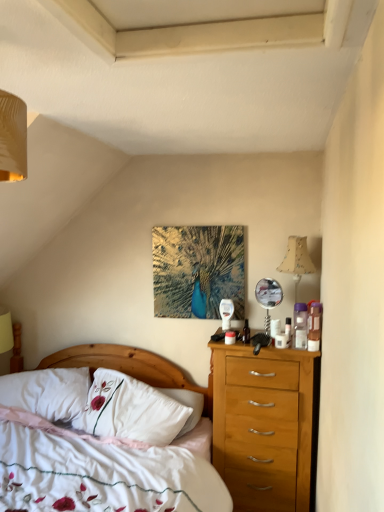
Question: Considering the positions of point (132, 486) and point (102, 406), is point (132, 486) closer or farther from the camera than point (102, 406)?

Choices:
 (A) farther
 (B) closer

Answer: (B)

Question: Would you say white cotton bed at center is to the left or to the right of white embroidered pillow at center, acting as the second pillow starting from the left, in the picture?

Choices:
 (A) right
 (B) left

Answer: (B)

Question: Which object is positioned closest to the beige fabric lampshade at right?

Choices:
 (A) metallic peacock art at center
 (B) white embroidered pillow at center, acting as the second pillow starting from the left
 (C) white cotton bed at center
 (D) white soft pillow at lower left, which is the first pillow in left-to-right order

Answer: (A)

Question: Which object is the farthest from the white soft pillow at lower left, which is the first pillow in left-to-right order?

Choices:
 (A) beige fabric lampshade at right
 (B) white embroidered pillow at center, the first pillow viewed from the right
 (C) white cotton bed at center
 (D) metallic peacock art at center

Answer: (A)